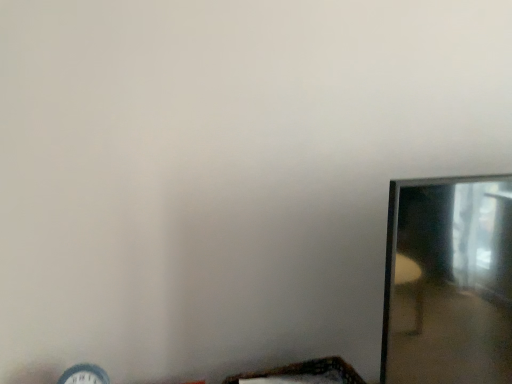
In order to click on matte white clock at lower left in this screenshot , I will do `click(84, 375)`.

The height and width of the screenshot is (384, 512). I want to click on clear glass mirror at right, so click(448, 282).

Between matte white clock at lower left and clear glass mirror at right, which one has larger width?

clear glass mirror at right is wider.

Who is more distant, matte white clock at lower left or clear glass mirror at right?

matte white clock at lower left is behind.

From the image's perspective, does matte white clock at lower left appear higher than clear glass mirror at right?

Actually, matte white clock at lower left appears below clear glass mirror at right in the image.

What's the angular difference between matte white clock at lower left and clear glass mirror at right's facing directions?

There is a 4.37-degree angle between the facing directions of matte white clock at lower left and clear glass mirror at right.

Is wooden woven basket at lower center far away from clear glass mirror at right?

No, there isn't a large distance between wooden woven basket at lower center and clear glass mirror at right.

Can you tell me how much wooden woven basket at lower center and clear glass mirror at right differ in facing direction?

The angle between the facing direction of wooden woven basket at lower center and the facing direction of clear glass mirror at right is 1.12 degrees.

Which is nearer, (323, 375) or (417, 300)?

The point (417, 300) is closer.

Who is taller, wooden woven basket at lower center or clear glass mirror at right?

Standing taller between the two is clear glass mirror at right.

How many degrees apart are the facing directions of clear glass mirror at right and wooden woven basket at lower center?

The angle between the facing direction of clear glass mirror at right and the facing direction of wooden woven basket at lower center is 1.12 degrees.

From the image's perspective, between clear glass mirror at right and wooden woven basket at lower center, who is located below?

wooden woven basket at lower center is shown below in the image.

Can you confirm if clear glass mirror at right is taller than wooden woven basket at lower center?

Yes, clear glass mirror at right is taller than wooden woven basket at lower center.

From a real-world perspective, who is located lower, clear glass mirror at right or wooden woven basket at lower center?

From a 3D spatial view, wooden woven basket at lower center is below.

Based on the photo, from a real-world perspective, is matte white clock at lower left over wooden woven basket at lower center?

Indeed, from a real-world perspective, matte white clock at lower left stands above wooden woven basket at lower center.

This screenshot has width=512, height=384. I want to click on basket below the matte white clock at lower left (from the image's perspective), so click(306, 372).

From the image's perspective, which one is positioned lower, matte white clock at lower left or wooden woven basket at lower center?

wooden woven basket at lower center appears lower in the image.

Which object is thinner, matte white clock at lower left or wooden woven basket at lower center?

matte white clock at lower left is thinner.

Who is smaller, clear glass mirror at right or matte white clock at lower left?

Smaller between the two is matte white clock at lower left.

From a real-world perspective, is clear glass mirror at right on matte white clock at lower left?

Yes, from a real-world perspective, clear glass mirror at right is on top of matte white clock at lower left.

Is clear glass mirror at right positioned beyond the bounds of matte white clock at lower left?

Indeed, clear glass mirror at right is completely outside matte white clock at lower left.

From the image's perspective, which one is positioned lower, clear glass mirror at right or matte white clock at lower left?

From the image's view, matte white clock at lower left is below.

In terms of height, does wooden woven basket at lower center look taller or shorter compared to matte white clock at lower left?

Clearly, wooden woven basket at lower center is shorter compared to matte white clock at lower left.

From the image's perspective, is wooden woven basket at lower center positioned above or below matte white clock at lower left?

Clearly, from the image's perspective, wooden woven basket at lower center is below matte white clock at lower left.

From a real-world perspective, is wooden woven basket at lower center above or below matte white clock at lower left?

Clearly, from a real-world perspective, wooden woven basket at lower center is below matte white clock at lower left.

This screenshot has height=384, width=512. I want to click on clock behind the clear glass mirror at right, so click(x=84, y=375).

I want to click on basket on the left of clear glass mirror at right, so click(x=306, y=372).

Considering their positions, is clear glass mirror at right positioned closer to wooden woven basket at lower center than matte white clock at lower left?

clear glass mirror at right is positioned closer to the anchor wooden woven basket at lower center.

From the image, which object appears to be farther from wooden woven basket at lower center, matte white clock at lower left or clear glass mirror at right?

matte white clock at lower left lies further to wooden woven basket at lower center than the other object.

Based on the photo, looking at the image, which one is located further to clear glass mirror at right, wooden woven basket at lower center or matte white clock at lower left?

Among the two, matte white clock at lower left is located further to clear glass mirror at right.

Considering their positions, is matte white clock at lower left positioned closer to clear glass mirror at right than wooden woven basket at lower center?

Based on the image, wooden woven basket at lower center appears to be nearer to clear glass mirror at right.

Looking at the image, which one is located closer to matte white clock at lower left, wooden woven basket at lower center or clear glass mirror at right?

wooden woven basket at lower center is positioned closer to the anchor matte white clock at lower left.

When comparing their distances from matte white clock at lower left, does clear glass mirror at right or wooden woven basket at lower center seem further?

Among the two, clear glass mirror at right is located further to matte white clock at lower left.

Locate an element on the screen. This screenshot has height=384, width=512. basket located between matte white clock at lower left and clear glass mirror at right in the left-right direction is located at coordinates (306, 372).